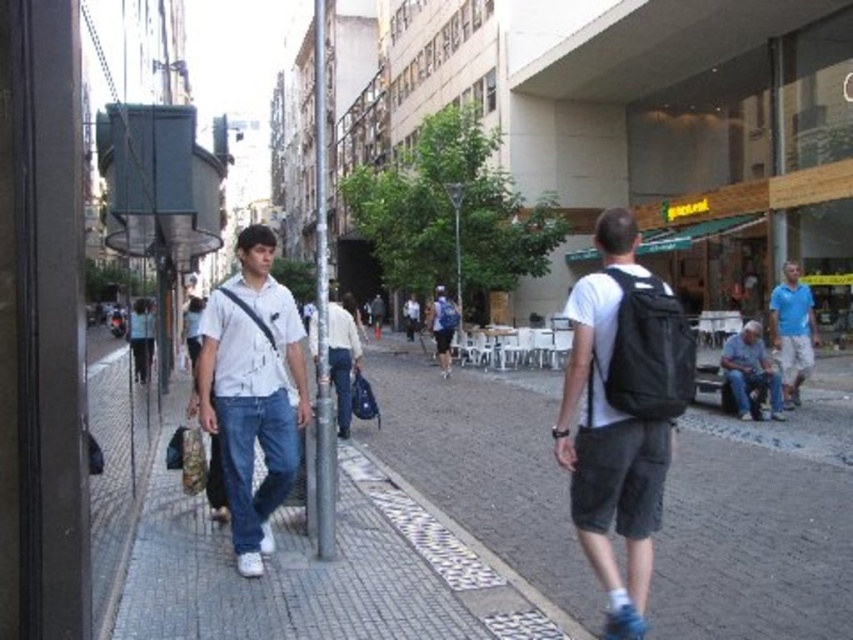
Question: Estimate the real-world distances between objects in this image. Which object is farther from the blue cotton shirt at right?

Choices:
 (A) black matte backpack at center
 (B) brick pavement at center

Answer: (A)

Question: Which point is farther to the camera?

Choices:
 (A) matte blue backpack at center
 (B) silver metallic pole at center

Answer: (A)

Question: Does blue cotton shirt at right come behind denim jeans at lower right?

Choices:
 (A) yes
 (B) no

Answer: (A)

Question: Which object appears closest to the camera in this image?

Choices:
 (A) black matte backpack at center
 (B) white matte shirt at center
 (C) smooth concrete sidewalk at center
 (D) matte blue backpack at center

Answer: (A)

Question: In this image, where is black matte backpack at center located relative to silver metallic pole at center?

Choices:
 (A) below
 (B) above

Answer: (A)

Question: Can you confirm if smooth concrete sidewalk at center is positioned to the right of blue cotton shirt at right?

Choices:
 (A) yes
 (B) no

Answer: (B)